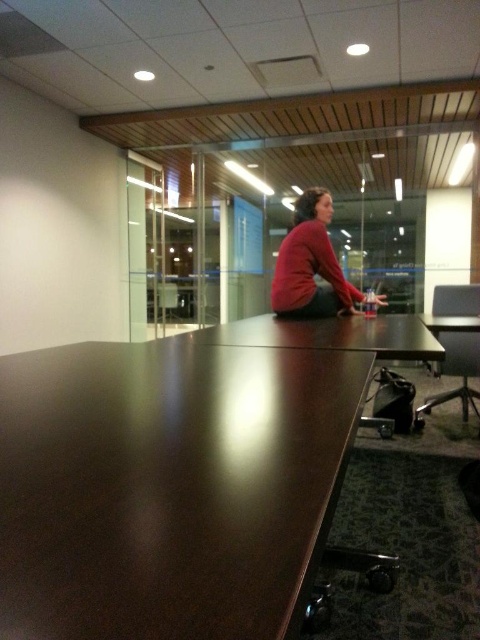
Which is more to the left, glossy wood table at center or matte brown table at lower right?

glossy wood table at center is more to the left.

Between glossy wood table at center and matte brown table at lower right, which one appears on the right side from the viewer's perspective?

matte brown table at lower right

Where is `glossy wood table at center`? The height and width of the screenshot is (640, 480). glossy wood table at center is located at coordinates (168, 486).

Which is more to the right, glossy wood table at center or matte red sweater at center?

From the viewer's perspective, matte red sweater at center appears more on the right side.

Can you confirm if glossy wood table at center is wider than matte red sweater at center?

Yes, glossy wood table at center is wider than matte red sweater at center.

Between point (189, 484) and point (333, 276), which one is positioned behind?

The point (333, 276) is behind.

The width and height of the screenshot is (480, 640). Identify the location of glossy wood table at center. (168, 486).

In the scene shown: Which is below, matte red sweater at center or matte brown table at lower right?

matte brown table at lower right is lower down.

At what (x,y) coordinates should I click in order to perform the action: click on matte red sweater at center. Please return your answer as a coordinate pair (x, y). Looking at the image, I should click on (312, 266).